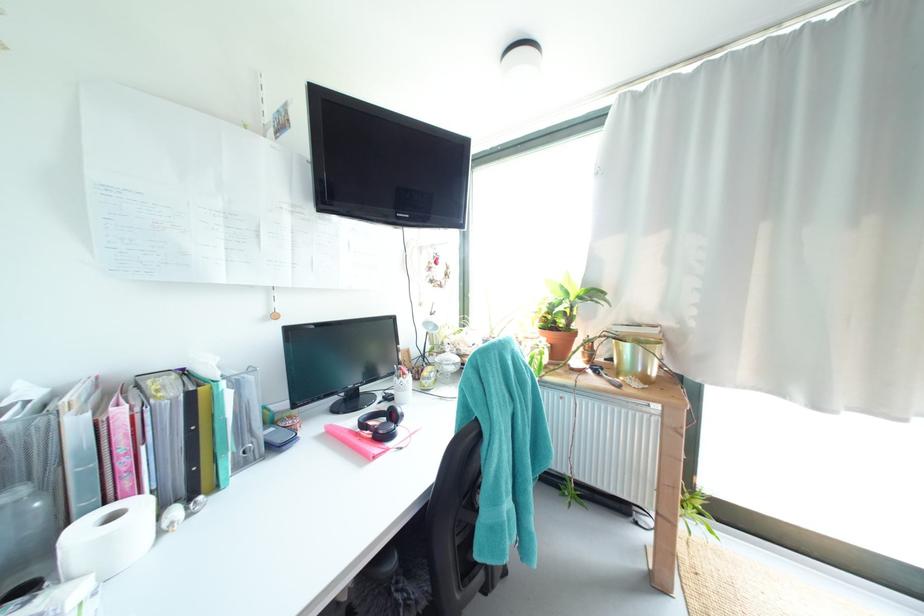
Where would you lift the pink patterned binder? Please return your answer as a coordinate pair (x, y).

(122, 447)